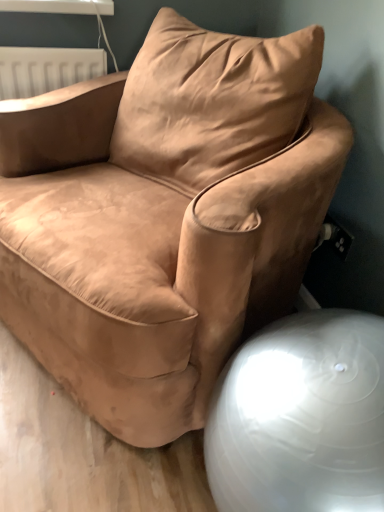
This screenshot has width=384, height=512. Describe the element at coordinates (301, 417) in the screenshot. I see `white glossy ball at lower right` at that location.

Where is `white glossy ball at lower right`? white glossy ball at lower right is located at coordinates (301, 417).

The width and height of the screenshot is (384, 512). In order to click on white glossy ball at lower right in this screenshot , I will do pyautogui.click(x=301, y=417).